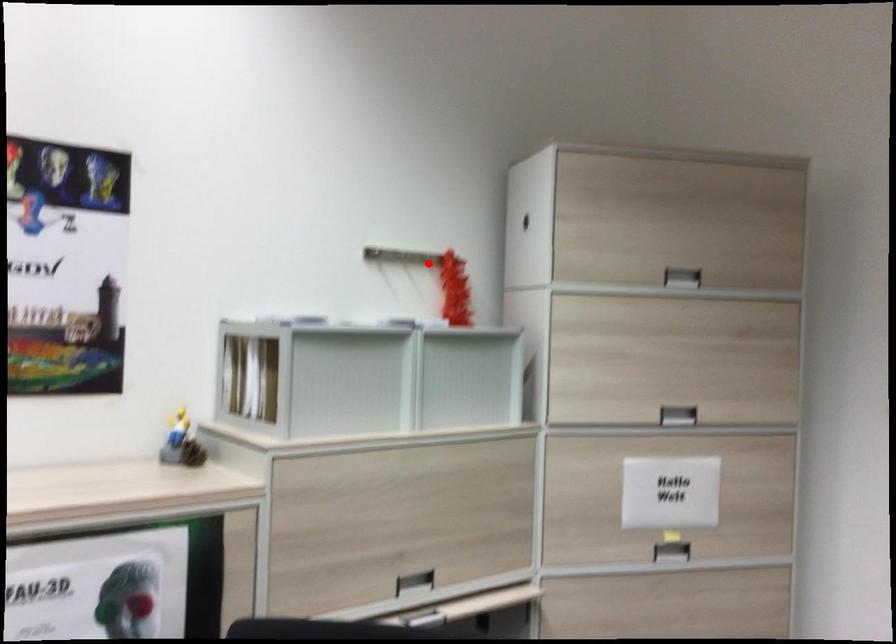
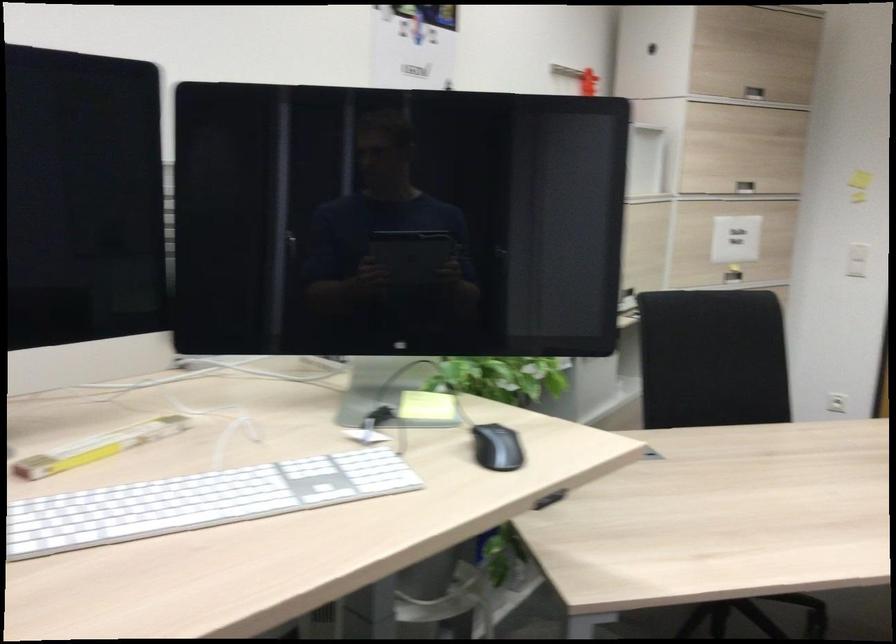
Locate, in the second image, the point that corresponds to the highlighted location in the first image.

(579, 78)